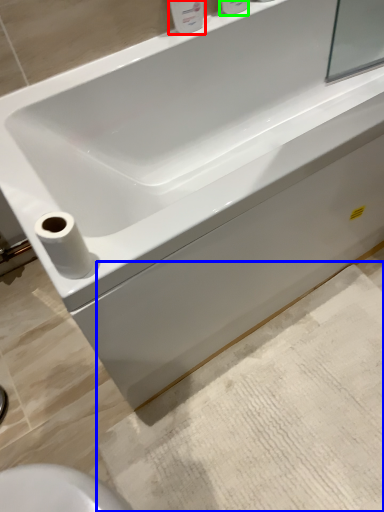
Question: Which is nearer to the toiletry (highlighted by a red box)? bath mat (highlighted by a blue box) or toiletry (highlighted by a green box).

Choices:
 (A) bath mat
 (B) toiletry

Answer: (B)